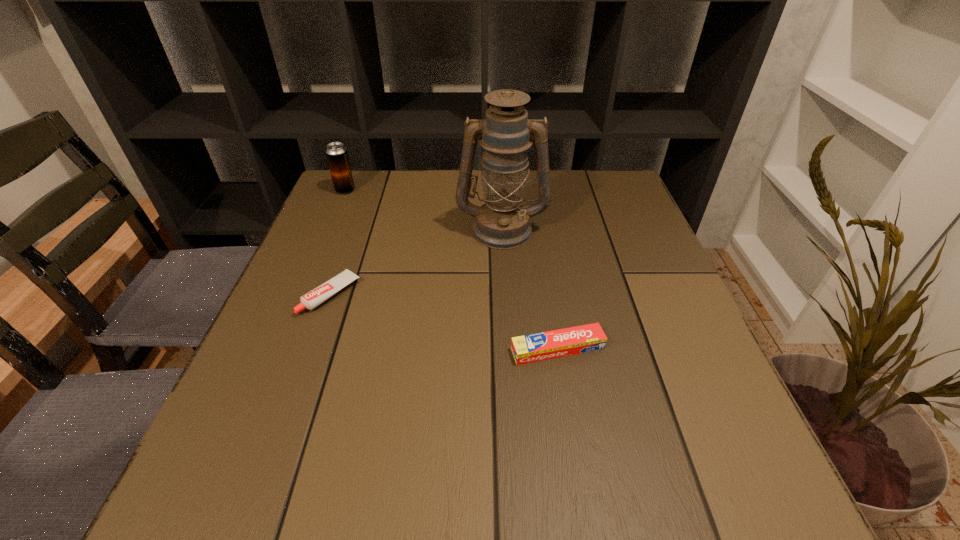
Find the location of `vacant space situated 0.080m on the right of the second nearest object`. vacant space situated 0.080m on the right of the second nearest object is located at coordinates (396, 295).

Find the location of `free space located on the right of the right toothpaste`. free space located on the right of the right toothpaste is located at coordinates (708, 349).

The height and width of the screenshot is (540, 960). I want to click on oil lamp positioned at the far edge, so click(x=502, y=222).

At what (x,y) coordinates should I click in order to perform the action: click on beer can that is at the far edge. Please return your answer as a coordinate pair (x, y). Looking at the image, I should click on (337, 156).

At what (x,y) coordinates should I click in order to perform the action: click on beer can that is at the left edge. Please return your answer as a coordinate pair (x, y). Looking at the image, I should click on (337, 156).

You are a GUI agent. You are given a task and a screenshot of the screen. Output one action in this format:
    pyautogui.click(x=<x>, y=<y>)
    Task: Click on the toothpaste that is positioned at the left edge
    
    Given the screenshot: What is the action you would take?
    pyautogui.click(x=314, y=298)

Identify the location of object positioned at the far left corner. (337, 156).

This screenshot has width=960, height=540. I want to click on vacant space at the far edge of the desktop, so click(456, 194).

The height and width of the screenshot is (540, 960). In the image, there is a desktop. What are the coordinates of `vacant space at the near edge` in the screenshot? It's located at (536, 462).

Where is `blank space at the left edge of the desktop`? The height and width of the screenshot is (540, 960). blank space at the left edge of the desktop is located at coordinates (258, 427).